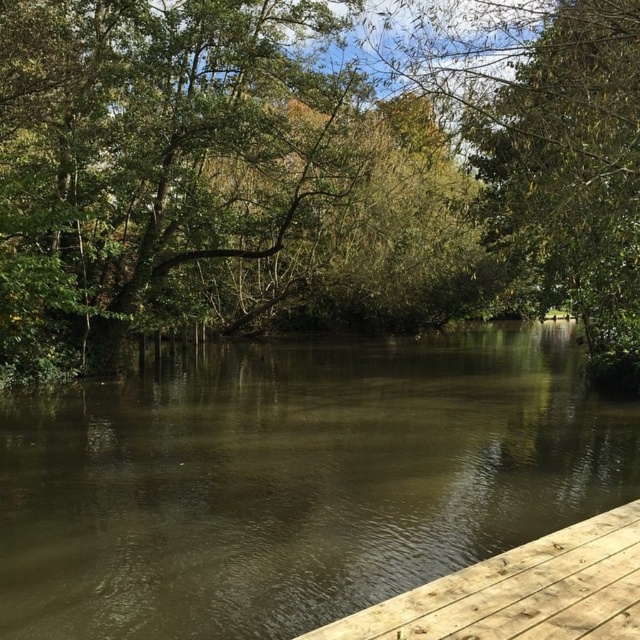
Does green leafy tree at center appear over brown wooden dock at lower right?

Indeed, green leafy tree at center is positioned over brown wooden dock at lower right.

Where is `green leafy tree at center`? The height and width of the screenshot is (640, 640). green leafy tree at center is located at coordinates (310, 173).

Where is `green leafy tree at center`? The image size is (640, 640). green leafy tree at center is located at coordinates (310, 173).

Does brown murky water at center have a lesser height compared to brown wooden dock at lower right?

Incorrect, brown murky water at center's height does not fall short of brown wooden dock at lower right's.

Which is above, brown murky water at center or brown wooden dock at lower right?

brown murky water at center is above.

Find the location of a particular element. The width and height of the screenshot is (640, 640). brown murky water at center is located at coordinates (294, 481).

Is point (54, 353) farther from viewer compared to point (602, 496)?

Yes, it is.

Looking at this image, who is higher up, green leafy tree at center or brown murky water at center?

green leafy tree at center is higher up.

Image resolution: width=640 pixels, height=640 pixels. What are the coordinates of `green leafy tree at center` in the screenshot? It's located at (310, 173).